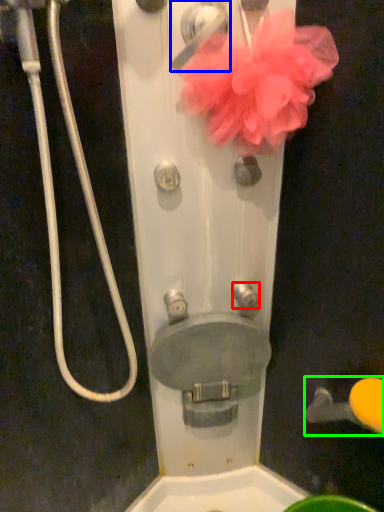
Question: Estimate the real-world distances between objects in this image. Which object is farther from knob (highlighted by a red box), door handle (highlighted by a blue box) or door handle (highlighted by a green box)?

Choices:
 (A) door handle
 (B) door handle

Answer: (A)